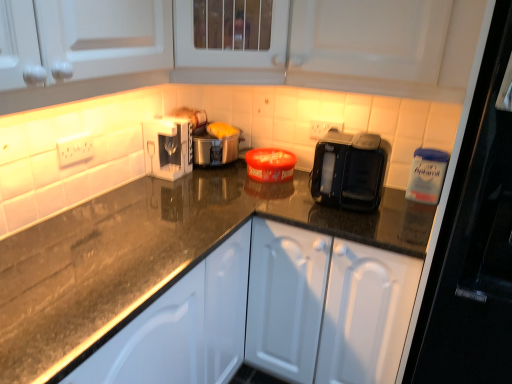
Question: Considering the positions of point (177, 150) and point (254, 246), is point (177, 150) closer or farther from the camera than point (254, 246)?

Choices:
 (A) farther
 (B) closer

Answer: (A)

Question: From a real-world perspective, relative to white matte cabinet at center, is white glossy coffee machine at upper center vertically above or below?

Choices:
 (A) above
 (B) below

Answer: (A)

Question: Which object is positioned closest to the white matte cabinet at center?

Choices:
 (A) white glossy coffee machine at upper center
 (B) matte plastic toaster at center

Answer: (B)

Question: Considering the real-world distances, which object is closest to the white matte cabinet at center?

Choices:
 (A) matte plastic toaster at center
 (B) white glossy coffee machine at upper center

Answer: (A)